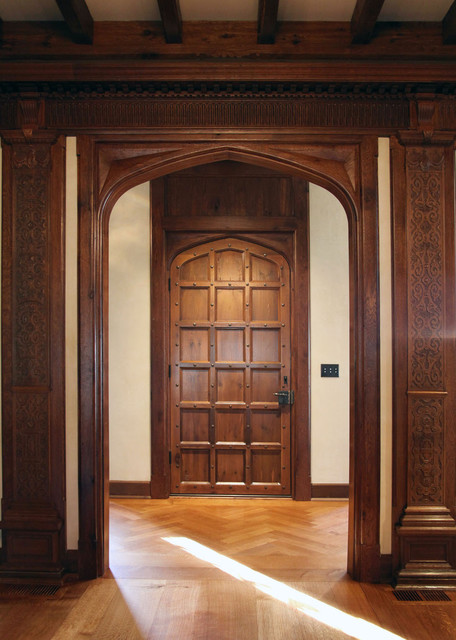
Identify the location of light switch. The width and height of the screenshot is (456, 640). (333, 371).